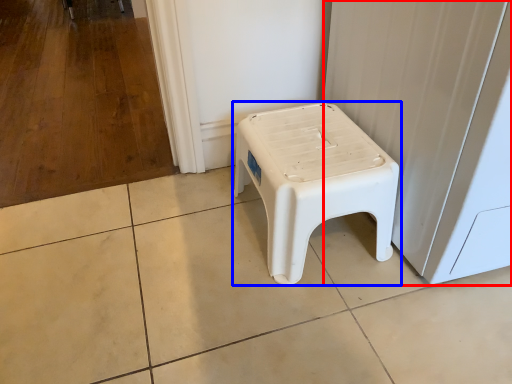
Question: Which point is further to the camera, screen door (highlighted by a red box) or stool (highlighted by a blue box)?

Choices:
 (A) screen door
 (B) stool

Answer: (B)